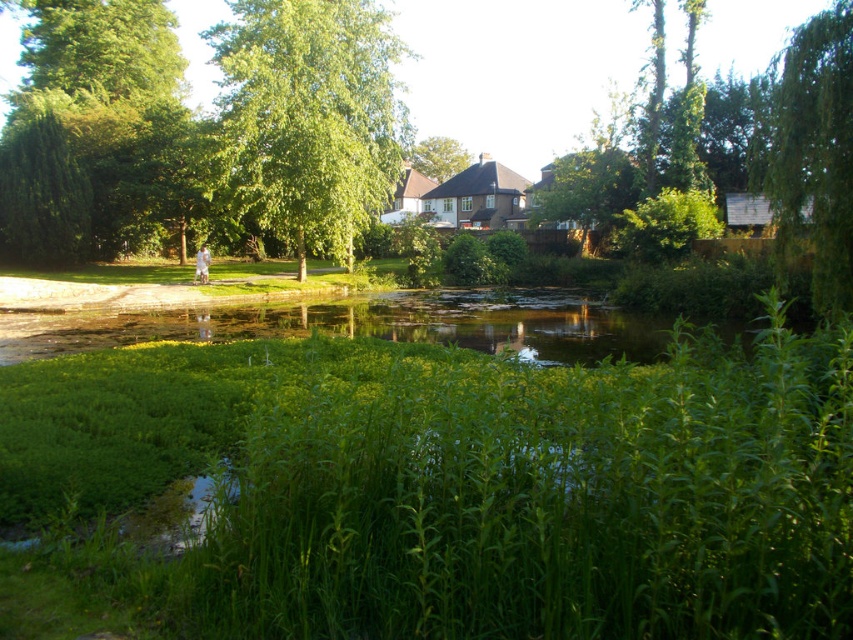
You are a bird flying over the serene scene. You need to land on a spot that can support your weight. Which object between the green leafy grass at center and the green leafy tree at upper left would be more stable for landing?

The green leafy tree at upper left is larger than the green leafy grass at center, so it would provide a more stable landing spot for the bird.

You are standing in the serene scene and want to take a photo of both the green leafy tree at upper left and the green leafy tree at right. Which tree should you position yourself closer to in order to capture both in a single frame?

To capture both the green leafy tree at upper left and the green leafy tree at right in a single frame, you should position yourself closer to the green leafy tree at upper left since it is to the left of the green leafy tree at right, allowing both to fit within the camera frame.